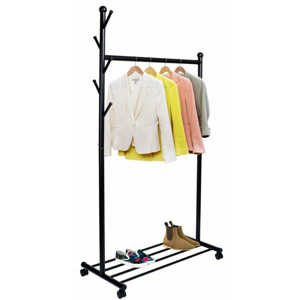
Image resolution: width=300 pixels, height=300 pixels. In order to click on hangers in this screenshot , I will do `click(133, 64)`, `click(150, 68)`, `click(163, 68)`, `click(177, 68)`.